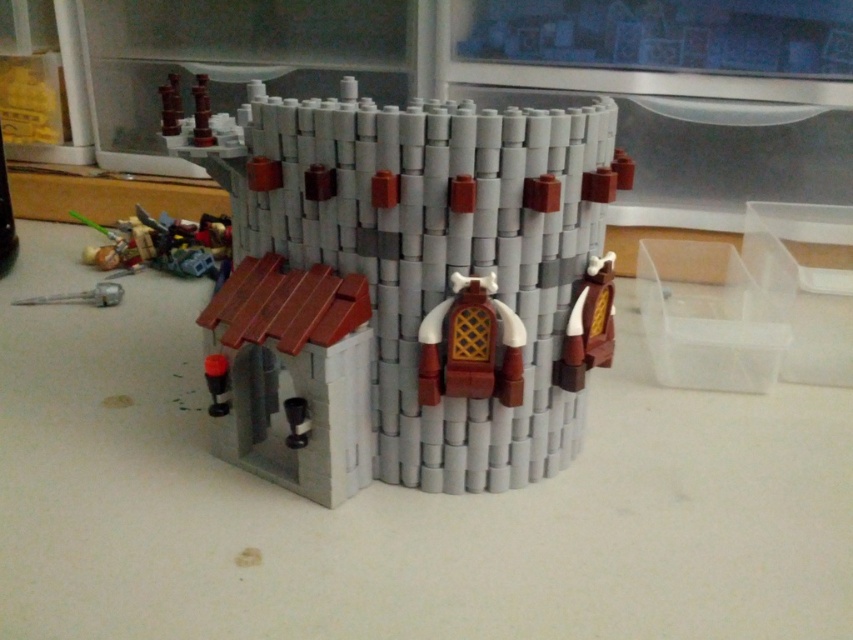
Question: Is shiny plastic sword at lower left closer to camera compared to matte gray pipe at lower left?

Choices:
 (A) no
 (B) yes

Answer: (A)

Question: Estimate the real-world distances between objects in this image. Which object is farther from the matte black cylinder at lower left?

Choices:
 (A) smooth gray castle at center
 (B) matte gray pipe at lower left
 (C) brown matte armor at center
 (D) shiny plastic sword at lower left

Answer: (D)

Question: Which point is closer to the camera taking this photo?

Choices:
 (A) (223, 248)
 (B) (281, 342)
 (C) (103, 284)

Answer: (B)

Question: Among these points, which one is nearest to the camera?

Choices:
 (A) (218, 400)
 (B) (432, 326)
 (C) (596, 212)

Answer: (B)

Question: Is shiny plastic sword at lower left smaller than matte black cylinder at lower left?

Choices:
 (A) no
 (B) yes

Answer: (A)

Question: Can you confirm if brown matte armor at center is smaller than matte gray pipe at lower left?

Choices:
 (A) no
 (B) yes

Answer: (B)